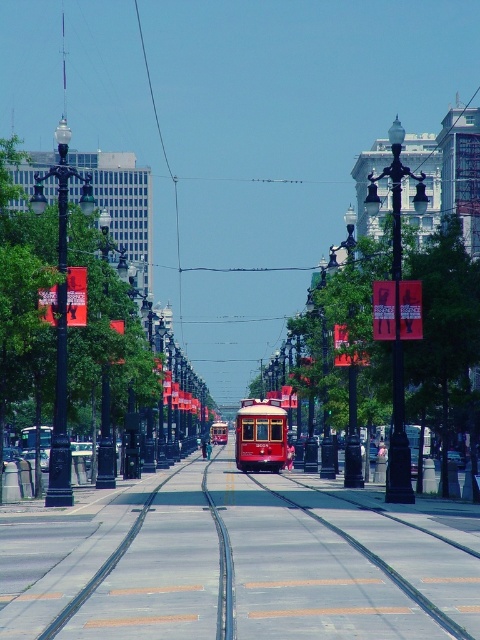
Question: Can you confirm if metallic track at center is positioned to the left of polished wood tram at center?

Choices:
 (A) no
 (B) yes

Answer: (B)

Question: Which object appears farthest from the camera in this image?

Choices:
 (A) polished wood tram at center
 (B) metallic track at center

Answer: (A)

Question: Is metallic track at center further to the viewer compared to polished wood tram at center?

Choices:
 (A) no
 (B) yes

Answer: (A)

Question: Can you confirm if metallic track at center is positioned below polished wood tram at center?

Choices:
 (A) yes
 (B) no

Answer: (B)

Question: Among these points, which one is nearest to the camera?

Choices:
 (A) (302, 484)
 (B) (253, 442)

Answer: (A)